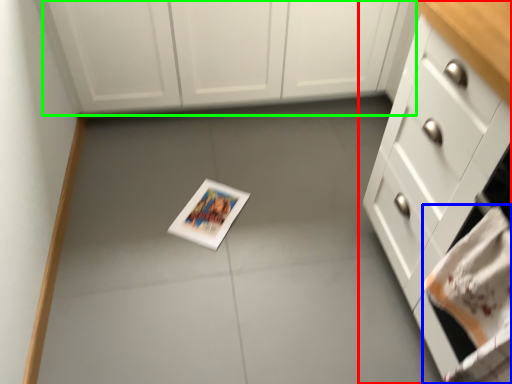
Question: Which object is positioned closest to cabinetry (highlighted by a red box)? Select from hand towel (highlighted by a blue box) and cabinetry (highlighted by a green box).

Choices:
 (A) hand towel
 (B) cabinetry

Answer: (A)